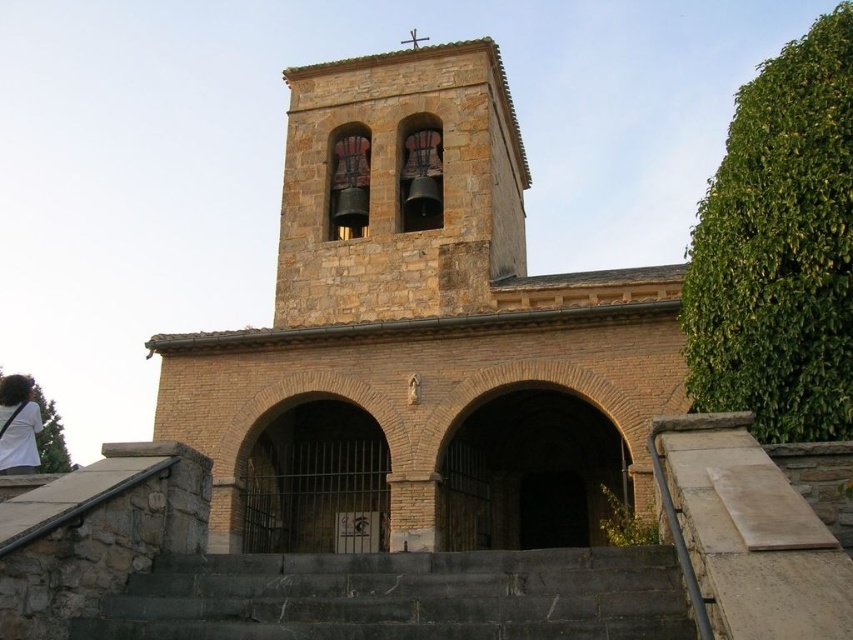
Question: Is brown stone chapel at center further to the viewer compared to white cotton shirt at lower left?

Choices:
 (A) yes
 (B) no

Answer: (A)

Question: Does dark gray stone stairs at center have a larger size compared to white cotton shirt at lower left?

Choices:
 (A) yes
 (B) no

Answer: (B)

Question: Observing the image, what is the correct spatial positioning of brown stone chapel at center in reference to dark gray stone stairs at center?

Choices:
 (A) right
 (B) left

Answer: (A)

Question: Which point is farther from the camera taking this photo?

Choices:
 (A) (415, 285)
 (B) (24, 444)

Answer: (A)

Question: Which object appears closest to the camera in this image?

Choices:
 (A) brown stone chapel at center
 (B) white cotton shirt at lower left
 (C) dark gray stone stairs at center

Answer: (C)

Question: Which of the following is the closest to the observer?

Choices:
 (A) (189, 576)
 (B) (566, 406)
 (C) (33, 467)

Answer: (A)